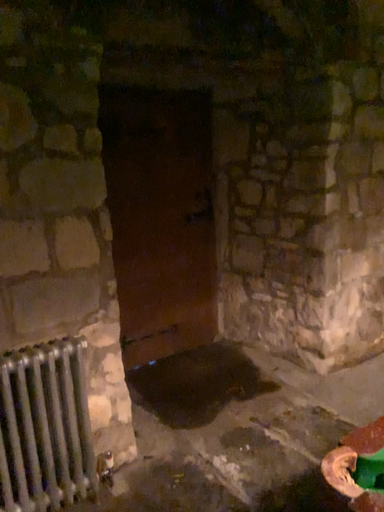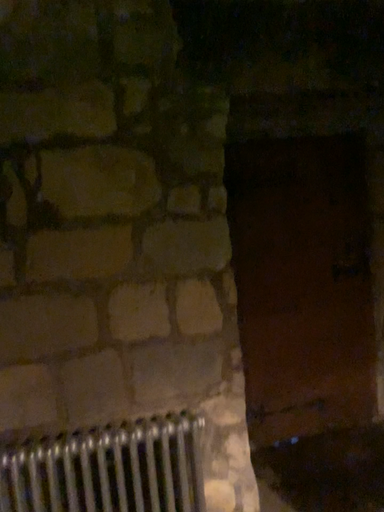
Question: How did the camera likely rotate when shooting the video?

Choices:
 (A) rotated left
 (B) rotated right

Answer: (A)